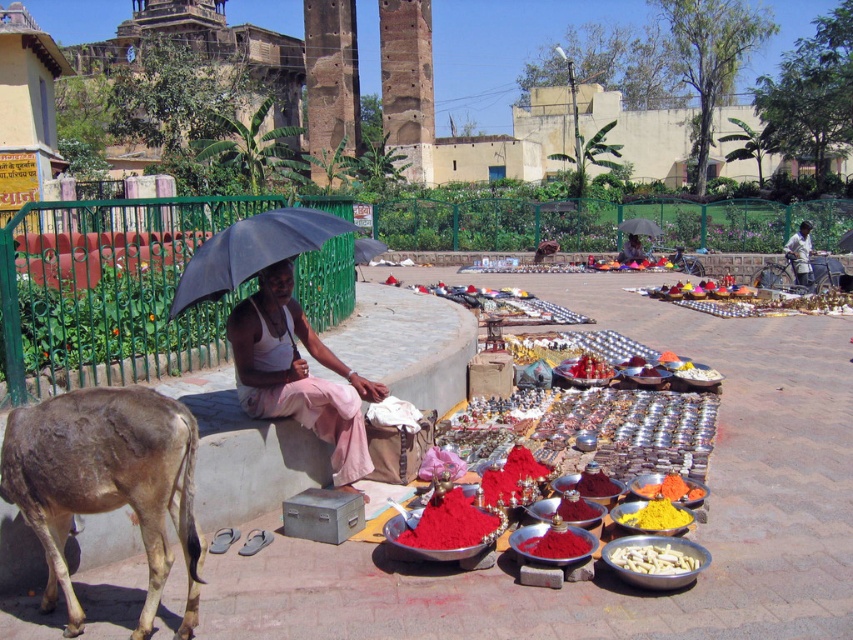
Is black matte umbrella at center thinner than powdered red spice at center?

Incorrect, black matte umbrella at center's width is not less than powdered red spice at center's.

Who is positioned more to the left, black matte umbrella at center or powdered red spice at center?

From the viewer's perspective, black matte umbrella at center appears more on the left side.

Does point (321, 228) come behind point (566, 548)?

Yes, it is.

Find the location of a particular element. Image resolution: width=853 pixels, height=640 pixels. black matte umbrella at center is located at coordinates (251, 250).

Is black matte umbrella at center to the right of orange powder at center from the viewer's perspective?

In fact, black matte umbrella at center is to the left of orange powder at center.

The image size is (853, 640). What do you see at coordinates (251, 250) in the screenshot?
I see `black matte umbrella at center` at bounding box center [251, 250].

The height and width of the screenshot is (640, 853). What do you see at coordinates (251, 250) in the screenshot? I see `black matte umbrella at center` at bounding box center [251, 250].

Where is `black matte umbrella at center`? black matte umbrella at center is located at coordinates (251, 250).

Is white matte food at lower center to the right of dark gray fabric shirt at right from the viewer's perspective?

No, white matte food at lower center is not to the right of dark gray fabric shirt at right.

Does point (662, 568) lie in front of point (809, 244)?

Yes, point (662, 568) is closer to viewer.

Who is more forward, (x=630, y=547) or (x=801, y=259)?

Point (x=630, y=547)

Locate an element on the screen. The image size is (853, 640). white matte food at lower center is located at coordinates (653, 560).